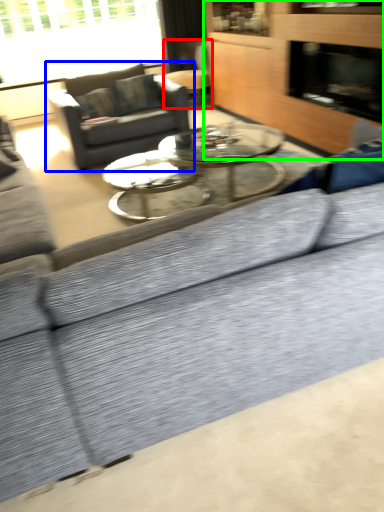
Question: Which object is positioned farthest from swivel chair (highlighted by a red box)? Select from studio couch (highlighted by a blue box) and dresser (highlighted by a green box).

Choices:
 (A) studio couch
 (B) dresser

Answer: (A)